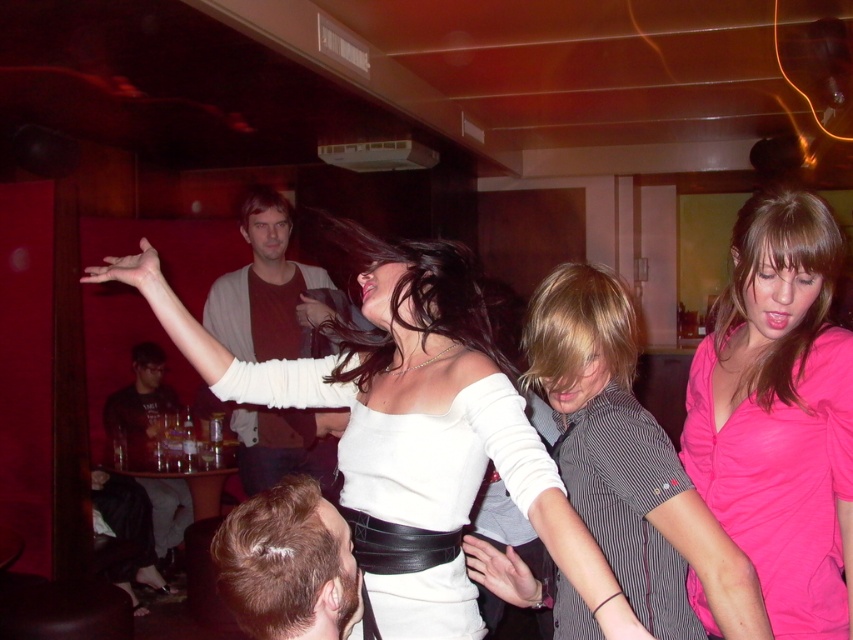
Between pink satin blouse at lower right and matte brown shirt at center, which one has less height?

pink satin blouse at lower right is shorter.

Is pink satin blouse at lower right positioned at the back of matte brown shirt at center?

No, pink satin blouse at lower right is closer to the viewer.

Measure the distance between point (x=808, y=371) and camera.

Point (x=808, y=371) is 4.60 feet away from camera.

Where is `pink satin blouse at lower right`? The width and height of the screenshot is (853, 640). pink satin blouse at lower right is located at coordinates (780, 413).

Can you confirm if pink satin blouse at lower right is positioned above dark gray shirt at lower left?

Yes, pink satin blouse at lower right is above dark gray shirt at lower left.

Locate an element on the screen. The width and height of the screenshot is (853, 640). pink satin blouse at lower right is located at coordinates (780, 413).

Identify the location of pink satin blouse at lower right. This screenshot has height=640, width=853. (780, 413).

Is pink satin blouse at lower right taller than blonde hair at lower left?

Correct, pink satin blouse at lower right is much taller as blonde hair at lower left.

Based on the photo, between pink satin blouse at lower right and blonde hair at lower left, which one has less height?

blonde hair at lower left

This screenshot has height=640, width=853. Describe the element at coordinates (780, 413) in the screenshot. I see `pink satin blouse at lower right` at that location.

What are the coordinates of `pink satin blouse at lower right` in the screenshot? It's located at (780, 413).